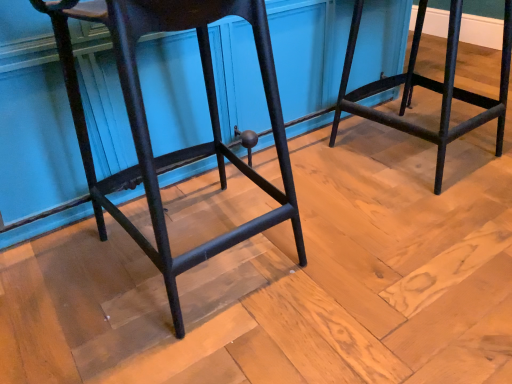
This screenshot has height=384, width=512. I want to click on vacant space that is to the left of black metal stool at right, which ranks as the first furniture in right-to-left order, so click(314, 167).